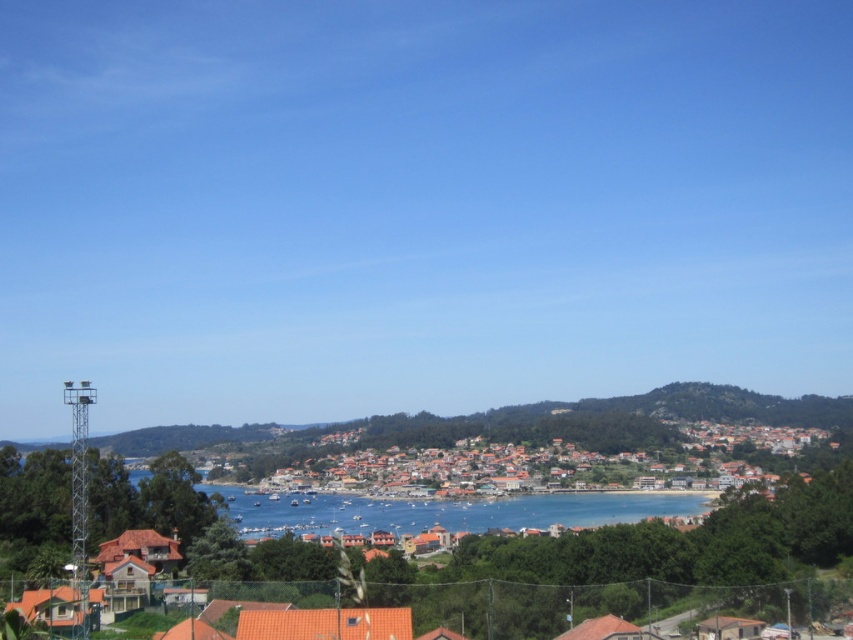
Does orange tiled roofs at center lie behind blue water at center?

Yes, it is.

The height and width of the screenshot is (640, 853). Describe the element at coordinates (541, 461) in the screenshot. I see `orange tiled roofs at center` at that location.

What are the coordinates of `orange tiled roofs at center` in the screenshot? It's located at (541, 461).